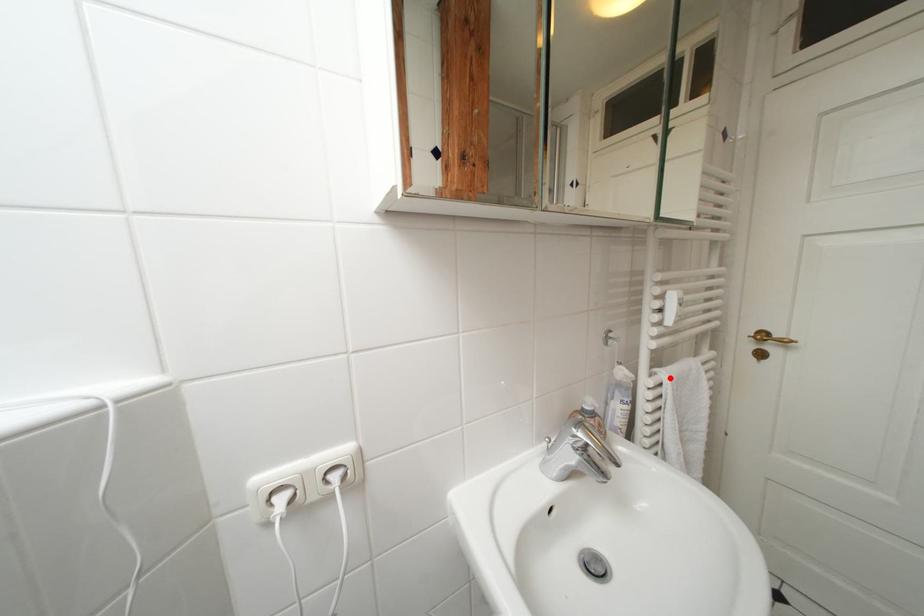
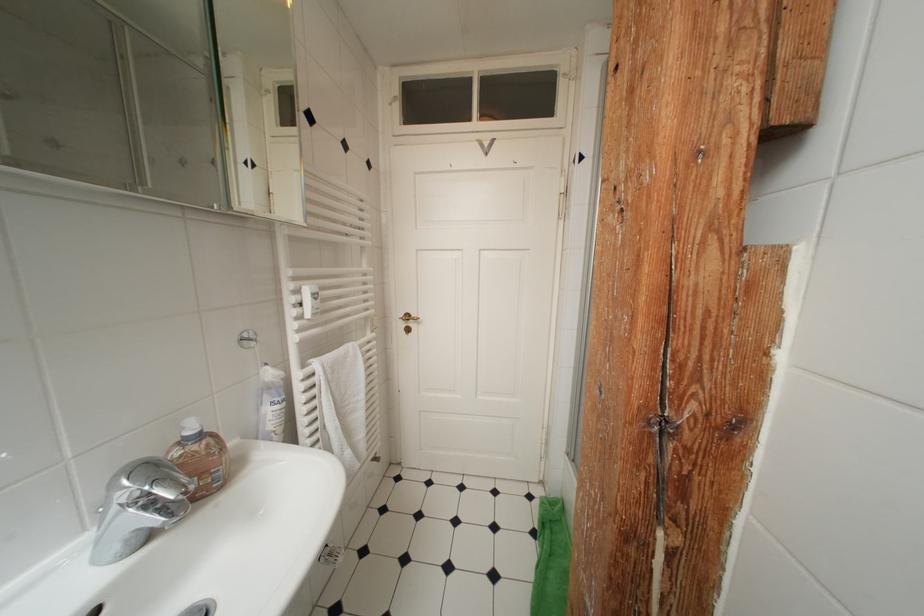
Find the pixel in the second image that matches the highlighted location in the first image.

(322, 368)